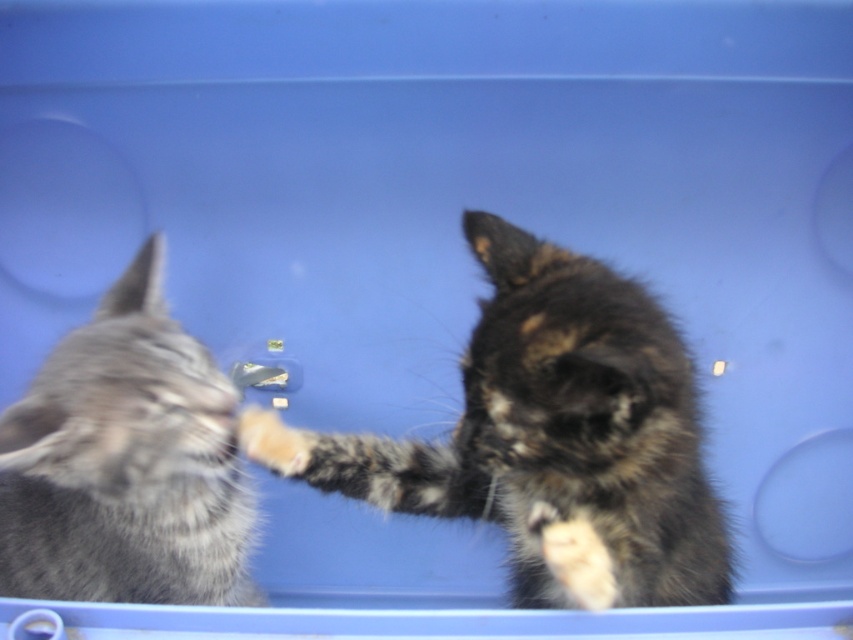
Question: Can you confirm if tabby fur cat at center is thinner than gray fluffy cat at left?

Choices:
 (A) no
 (B) yes

Answer: (A)

Question: Which point is closer to the camera?

Choices:
 (A) tabby fur cat at center
 (B) gray fluffy cat at left

Answer: (A)

Question: Is tabby fur cat at center thinner than gray fluffy cat at left?

Choices:
 (A) no
 (B) yes

Answer: (A)

Question: Which of the following is the closest to the observer?

Choices:
 (A) tabby fur cat at center
 (B) gray fluffy cat at left

Answer: (A)

Question: Which object is farther from the camera taking this photo?

Choices:
 (A) gray fluffy cat at left
 (B) tabby fur cat at center

Answer: (A)

Question: Is tabby fur cat at center smaller than gray fluffy cat at left?

Choices:
 (A) no
 (B) yes

Answer: (A)